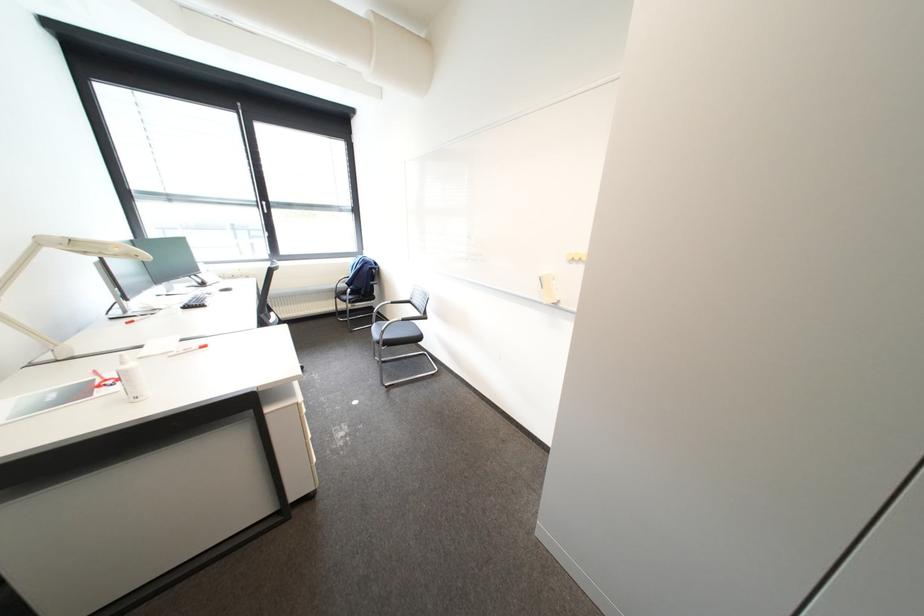
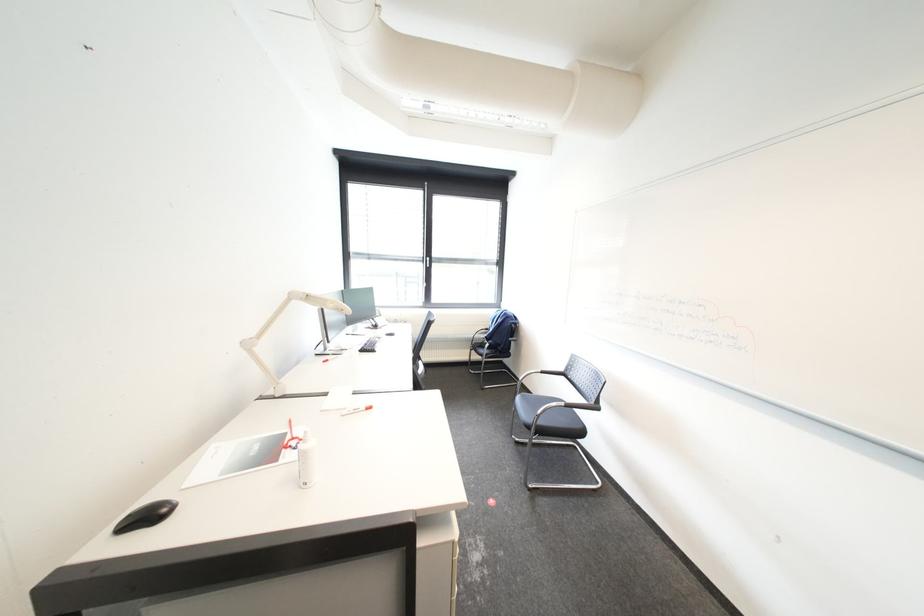
What movement of the cameraman would produce the second image?

The cameraman moved toward left, forward.